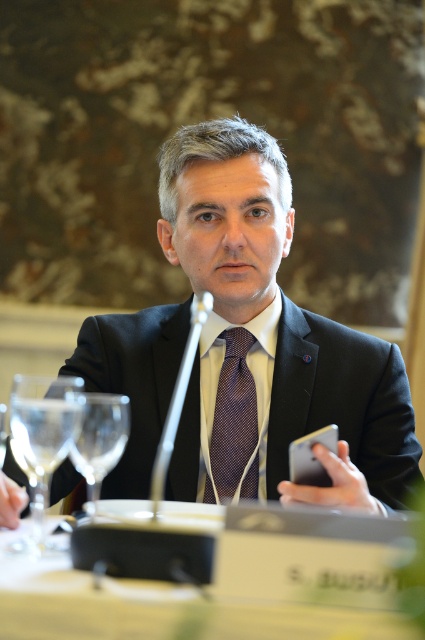
You are a photographer setting up for a formal event. You need to ensure that all participants are visible above the table. Given the scene described, will the matte black suit at center be visible above the clear glass wine glass at left from the camera angle shown?

The matte black suit at center is taller than the clear glass wine glass at left, so yes, it will be visible above the glass from the camera angle shown.

You are an event planner setting up a conference room. You see the matte black suit at center and the clear glass wine glass at left. Which object is positioned higher in the scene?

The matte black suit at center is located above the clear glass wine glass at left, so it is positioned higher in the scene.